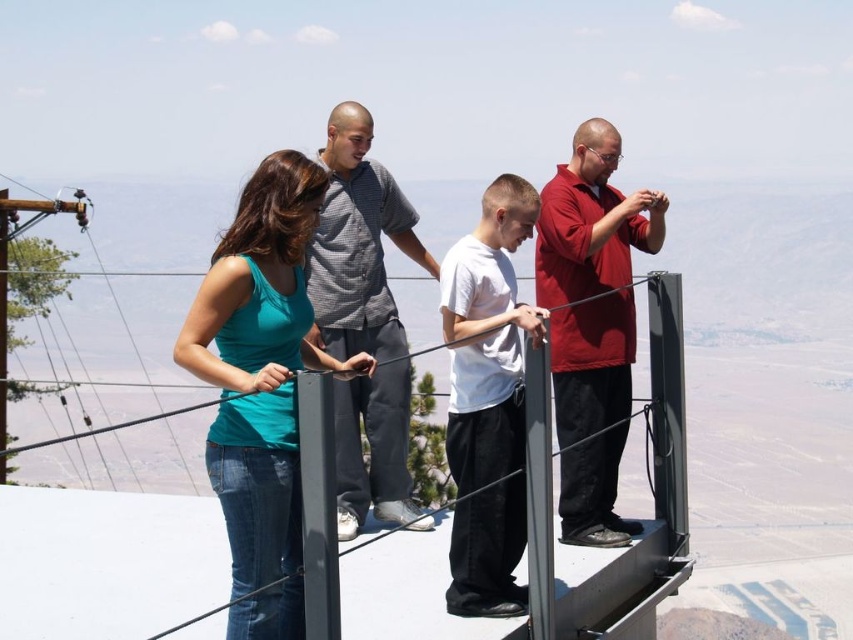
Does teal matte tank top at center appear on the left side of gray checkered shirt at center?

Indeed, teal matte tank top at center is positioned on the left side of gray checkered shirt at center.

Between point (299, 241) and point (346, 218), which one is positioned behind?

Point (346, 218)

Where is `teal matte tank top at center`? This screenshot has width=853, height=640. teal matte tank top at center is located at coordinates (260, 387).

Does teal matte tank top at center have a greater width compared to matte red shirt at right?

Indeed, teal matte tank top at center has a greater width compared to matte red shirt at right.

Measure the distance from teal matte tank top at center to matte red shirt at right.

teal matte tank top at center and matte red shirt at right are 8.71 feet apart.

Is point (274, 161) closer to viewer compared to point (555, 193)?

Yes.

Find the location of a particular element. This screenshot has height=640, width=853. teal matte tank top at center is located at coordinates (260, 387).

Does point (618, 388) come closer to viewer compared to point (344, 272)?

That is True.

Is matte red shirt at right positioned before gray checkered shirt at center?

No, matte red shirt at right is further to the viewer.

Between point (561, 374) and point (323, 316), which one is positioned in front?

Positioned in front is point (561, 374).

Locate an element on the screen. This screenshot has width=853, height=640. matte red shirt at right is located at coordinates (590, 280).